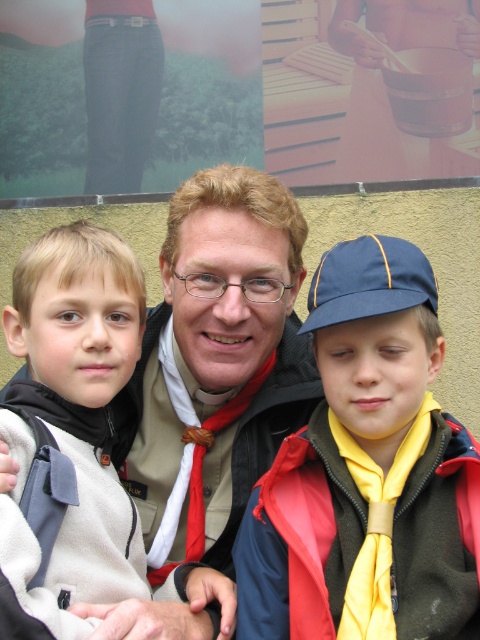
Is yellow matte scarf at center shorter than metallic silver pot at upper center?

No.

Which is behind, point (458, 588) or point (370, 26)?

Positioned behind is point (370, 26).

The height and width of the screenshot is (640, 480). Find the location of `yellow matte scarf at center`. yellow matte scarf at center is located at coordinates (368, 472).

Based on the photo, does yellow matte scarf at center have a smaller size compared to light brown hair at left?

No, yellow matte scarf at center is not smaller than light brown hair at left.

In the scene shown: Which is above, yellow matte scarf at center or light brown hair at left?

light brown hair at left is above.

What do you see at coordinates (368, 472) in the screenshot? The width and height of the screenshot is (480, 640). I see `yellow matte scarf at center` at bounding box center [368, 472].

Identify the location of yellow matte scarf at center. The image size is (480, 640). (368, 472).

Who is taller, light brown hair at left or metallic silver pot at upper center?

light brown hair at left is taller.

Is point (91, 225) positioned before point (457, 154)?

Yes, point (91, 225) is closer to viewer.

This screenshot has width=480, height=640. I want to click on light brown hair at left, so click(78, 314).